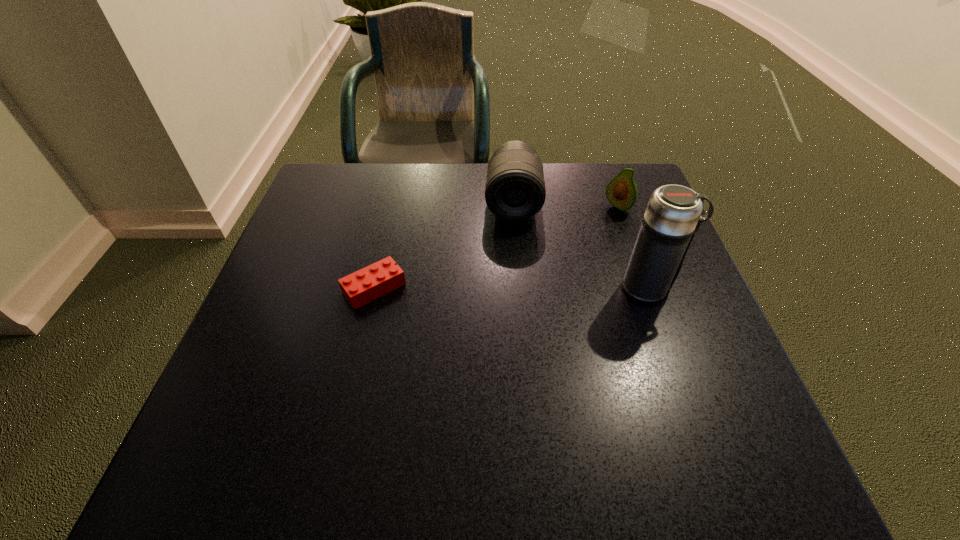
This screenshot has height=540, width=960. I want to click on free space between the shortest object and the second object from left to right, so click(444, 245).

I want to click on vacant area that lies between the third object from right to left and the leftmost object, so click(x=444, y=245).

Find the location of a particular element. Image resolution: width=960 pixels, height=540 pixels. free space between the tallest object and the telephoto lens is located at coordinates (581, 245).

At what (x,y) coordinates should I click in order to perform the action: click on free space between the tallest object and the avocado. Please return your answer as a coordinate pair (x, y). The image size is (960, 540). Looking at the image, I should click on (634, 248).

Locate which object is the closest to the avocado. Please provide its 2D coordinates. Your answer should be formatted as a tuple, i.e. [(x, y)], where the tuple contains the x and y coordinates of a point satisfying the conditions above.

[(515, 190)]

Identify which object is located as the third nearest to the tallest object. Please provide its 2D coordinates. Your answer should be formatted as a tuple, i.e. [(x, y)], where the tuple contains the x and y coordinates of a point satisfying the conditions above.

[(365, 285)]

Find the location of `vacant position in the image that satisfies the following two spatial constraints: 1. on the front side of the thermos bottle; 2. with a handle on the side of the third tallest object`. vacant position in the image that satisfies the following two spatial constraints: 1. on the front side of the thermos bottle; 2. with a handle on the side of the third tallest object is located at coordinates (647, 288).

I want to click on vacant space that satisfies the following two spatial constraints: 1. on the back side of the shortest object; 2. with a handle on the side of the tallest object, so click(x=374, y=288).

The height and width of the screenshot is (540, 960). In order to click on vacant position in the image that satisfies the following two spatial constraints: 1. on the front side of the tallest object; 2. with a handle on the side of the third tallest object in this screenshot , I will do `click(647, 288)`.

Locate an element on the screen. vacant area that satisfies the following two spatial constraints: 1. on the front side of the thermos bottle; 2. with a handle on the side of the third tallest object is located at coordinates 647,288.